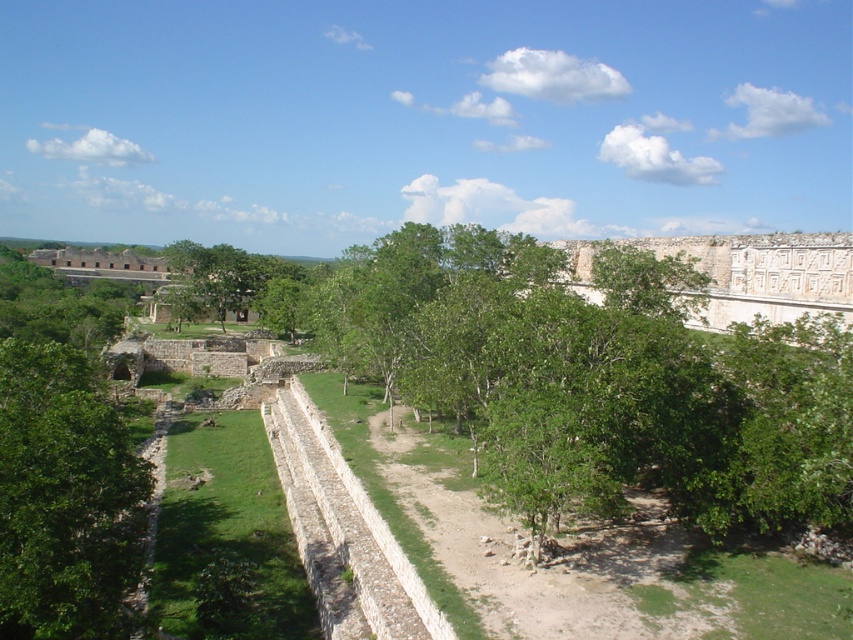
Question: Among these points, which one is nearest to the camera?

Choices:
 (A) (793, 260)
 (B) (48, 388)

Answer: (B)

Question: In this image, where is green leafy tree at left located relative to green leafy tree at center?

Choices:
 (A) below
 (B) above

Answer: (A)

Question: Is green leafy tree at left smaller than white stone wall at upper right?

Choices:
 (A) yes
 (B) no

Answer: (A)

Question: Can you confirm if green leafy tree at left is thinner than green leafy tree at center?

Choices:
 (A) yes
 (B) no

Answer: (A)

Question: Among these points, which one is nearest to the camera?

Choices:
 (A) (793, 259)
 (B) (32, 602)
 (C) (164, 248)

Answer: (B)

Question: Which object is farther from the camera taking this photo?

Choices:
 (A) green leafy tree at center
 (B) white stone wall at upper right

Answer: (A)